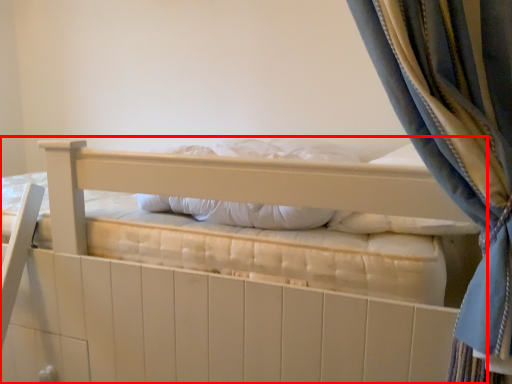
Question: From the image's perspective, what is the correct spatial positioning of bed (annotated by the red box) in reference to pillow?

Choices:
 (A) above
 (B) below

Answer: (B)